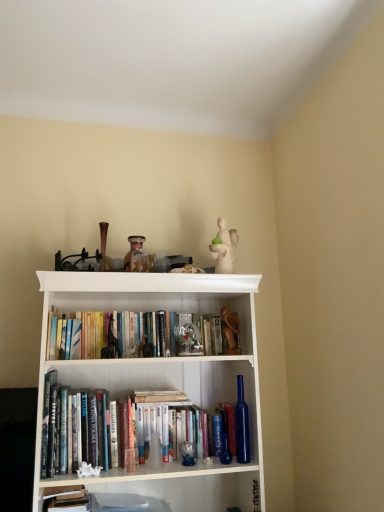
Question: Is point (147, 328) closer or farther from the camera than point (155, 377)?

Choices:
 (A) farther
 (B) closer

Answer: (B)

Question: Considering the positions of hardcover books at center, the 1th book from the top, and white wood bookshelf at center in the image, is hardcover books at center, the 1th book from the top, taller or shorter than white wood bookshelf at center?

Choices:
 (A) short
 (B) tall

Answer: (A)

Question: Which of these objects is positioned farthest from the matte glass jar at upper center, the 1th toy in the left-to-right sequence?

Choices:
 (A) white wood bookshelf at center
 (B) hardcover book at lower left, the first book viewed from the front
 (C) wooden figurine at center, the 3th toy in the left-to-right sequence
 (D) blue glass bottle at lower center
 (E) white porcelain figurine at upper center, the third toy positioned from the bottom

Answer: (B)

Question: Estimate the real-world distances between objects in this image. Which object is closer to the matte glass jar at upper center, the 3th toy from the right?

Choices:
 (A) white wood bookshelf at center
 (B) blue glass bottle at lower center
 (C) wooden figurine at center, the 3th toy in the left-to-right sequence
 (D) white porcelain figurine at upper center, which is counted as the second toy, starting from the left
 (E) hardcover book at lower left, the 2th book when ordered from back to front

Answer: (D)